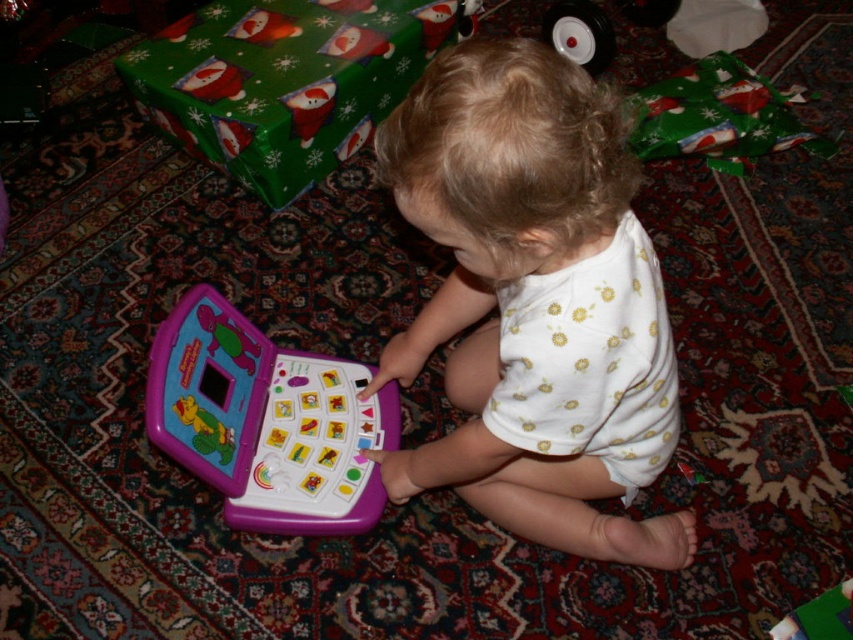
Is white dotted fabric at center shorter than purple plastic toy at center?

No.

Who is taller, white dotted fabric at center or purple plastic toy at center?

Standing taller between the two is white dotted fabric at center.

Who is more forward, (440, 445) or (325, 440)?

Positioned in front is point (440, 445).

Locate an element on the screen. The image size is (853, 640). white dotted fabric at center is located at coordinates (534, 301).